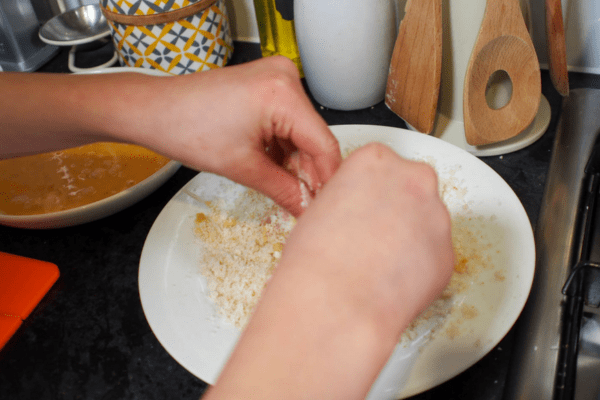
Locate an element on the screen. The width and height of the screenshot is (600, 400). wooden spoon is located at coordinates (503, 31).